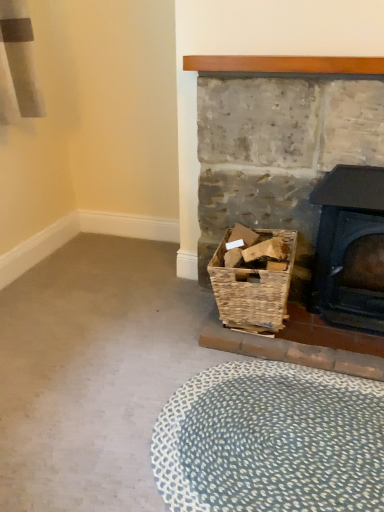
At what (x,y) coordinates should I click in order to perform the action: click on free space between woven brown basket at lower right and black cast iron wood burning stove at right. Please return your answer as a coordinate pair (x, y). Looking at the image, I should click on (320, 340).